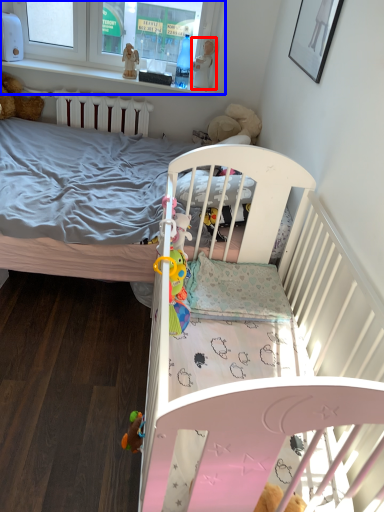
Question: Which object is closer to the camera taking this photo, toy (highlighted by a red box) or window frame (highlighted by a blue box)?

Choices:
 (A) toy
 (B) window frame

Answer: (B)